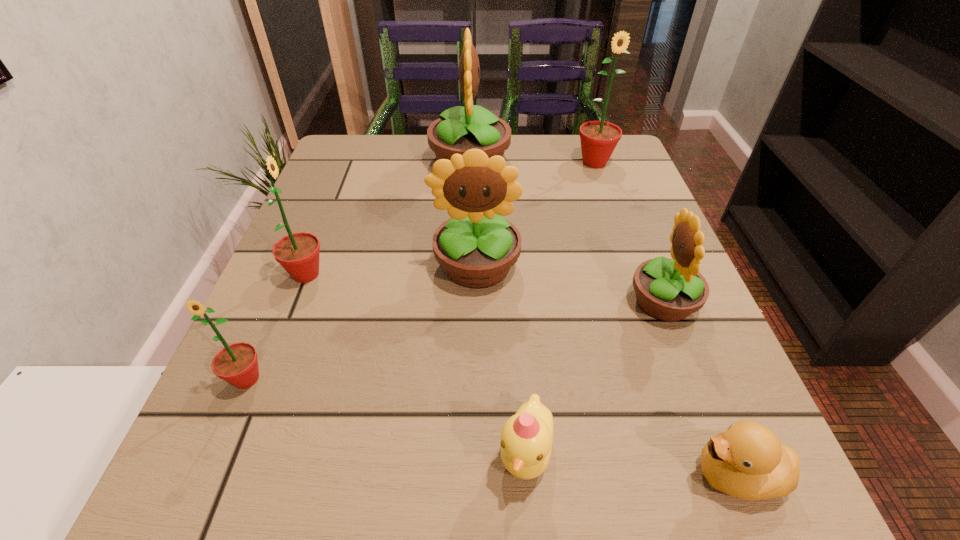
I want to click on vacant area situated on the face of the farthest yellow sunflower, so click(571, 162).

I want to click on vacant space located 0.340m on the face of the farthest green sunflower, so click(634, 274).

Locate an element on the screen. Image resolution: width=960 pixels, height=540 pixels. vacant space located 0.200m on the face of the second smallest yellow sunflower is located at coordinates (475, 402).

Where is `blank space located on the face of the second nearest green sunflower`? This screenshot has width=960, height=540. blank space located on the face of the second nearest green sunflower is located at coordinates (487, 274).

Identify the location of free region located 0.260m on the face of the rightmost yellow sunflower. (477, 301).

Find the location of a particular element. vacant space located 0.310m on the face of the rightmost yellow sunflower is located at coordinates (448, 301).

This screenshot has height=540, width=960. Identify the location of free space located 0.400m on the face of the rightmost yellow sunflower. (396, 301).

Identify the location of blank area located 0.120m on the face of the nearest green sunflower. The image size is (960, 540). (202, 484).

Image resolution: width=960 pixels, height=540 pixels. Find the location of `vacant space situated on the face of the right duckling`. vacant space situated on the face of the right duckling is located at coordinates (648, 475).

Image resolution: width=960 pixels, height=540 pixels. I want to click on vacant space situated 0.130m on the face of the right duckling, so click(x=585, y=475).